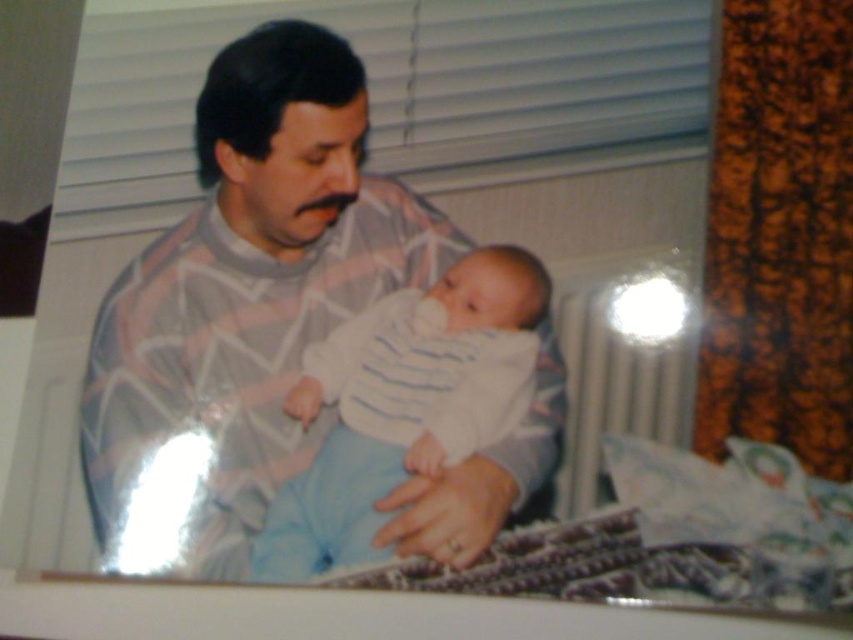
Question: Is striped sweater at center to the left of white striped fabric baby at center from the viewer's perspective?

Choices:
 (A) no
 (B) yes

Answer: (B)

Question: Does striped sweater at center have a larger size compared to white striped fabric baby at center?

Choices:
 (A) no
 (B) yes

Answer: (B)

Question: Which point is farther to the camera?

Choices:
 (A) striped sweater at center
 (B) white striped fabric baby at center

Answer: (B)

Question: Which point is farther to the camera?

Choices:
 (A) [497, 406]
 (B) [213, 506]

Answer: (B)

Question: Can you confirm if striped sweater at center is positioned below white striped fabric baby at center?

Choices:
 (A) yes
 (B) no

Answer: (B)